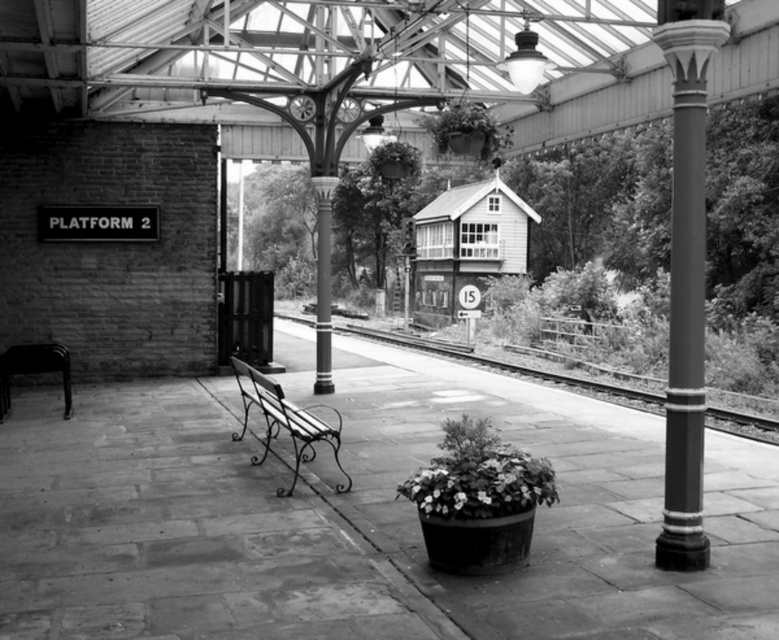
Which of these two, polished metal pole at right or wooden bench at center, stands taller?

polished metal pole at right

Can you confirm if polished metal pole at right is bigger than wooden bench at center?

Actually, polished metal pole at right might be smaller than wooden bench at center.

Measure the distance between point (661,552) and camera.

Point (661,552) and camera are 5.39 meters apart.

Locate an element on the screen. The image size is (779, 640). polished metal pole at right is located at coordinates (686, 276).

Does wooden signal box at center appear on the left side of black wrought iron bench at lower left?

No, wooden signal box at center is not to the left of black wrought iron bench at lower left.

Does wooden signal box at center have a greater width compared to black wrought iron bench at lower left?

Correct, the width of wooden signal box at center exceeds that of black wrought iron bench at lower left.

Which is in front, point (439, 301) or point (0, 406)?

Point (0, 406) is in front.

Identify the location of wooden signal box at center. The image size is (779, 640). (464, 248).

Measure the distance between polished metal pole at right and camera.

polished metal pole at right and camera are 5.26 meters apart.

Based on the photo, is polished metal pole at right taller than black wrought iron bench at lower left?

Incorrect, polished metal pole at right's height is not larger of black wrought iron bench at lower left's.

Locate an element on the screen. The image size is (779, 640). polished metal pole at right is located at coordinates (686, 276).